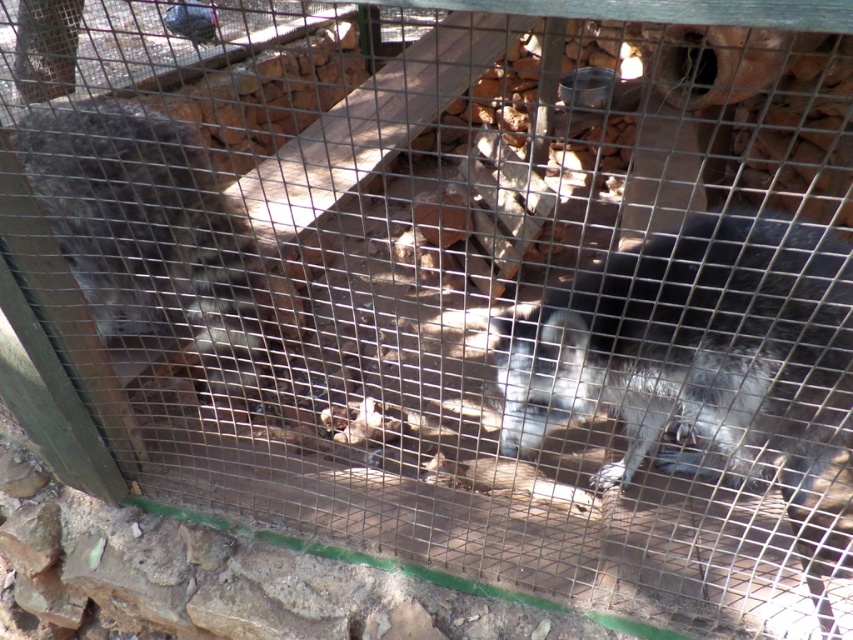
Question: Does gray fur monkey at center appear under gray furry animal at left?

Choices:
 (A) yes
 (B) no

Answer: (A)

Question: Which point is closer to the camera taking this photo?

Choices:
 (A) (747, 467)
 (B) (184, 244)

Answer: (A)

Question: Is gray fur monkey at center to the left of gray furry animal at left from the viewer's perspective?

Choices:
 (A) no
 (B) yes

Answer: (A)

Question: Does gray fur monkey at center lie in front of gray furry animal at left?

Choices:
 (A) yes
 (B) no

Answer: (A)